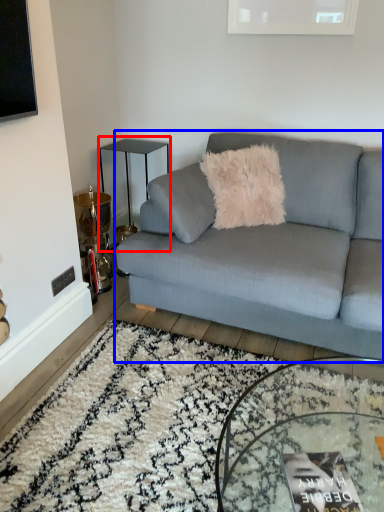
Question: Which point is closer to the camera, table (highlighted by a red box) or studio couch (highlighted by a blue box)?

Choices:
 (A) table
 (B) studio couch

Answer: (B)